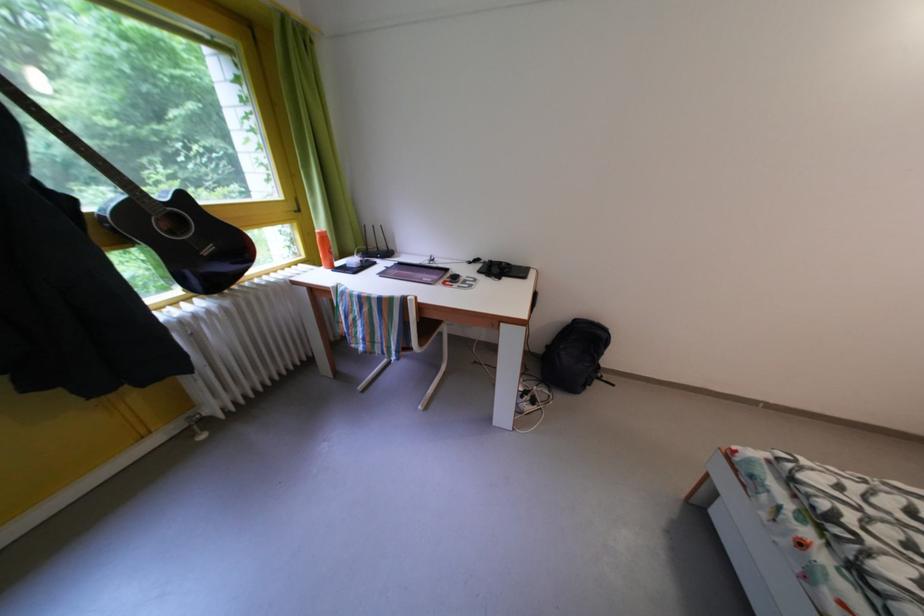
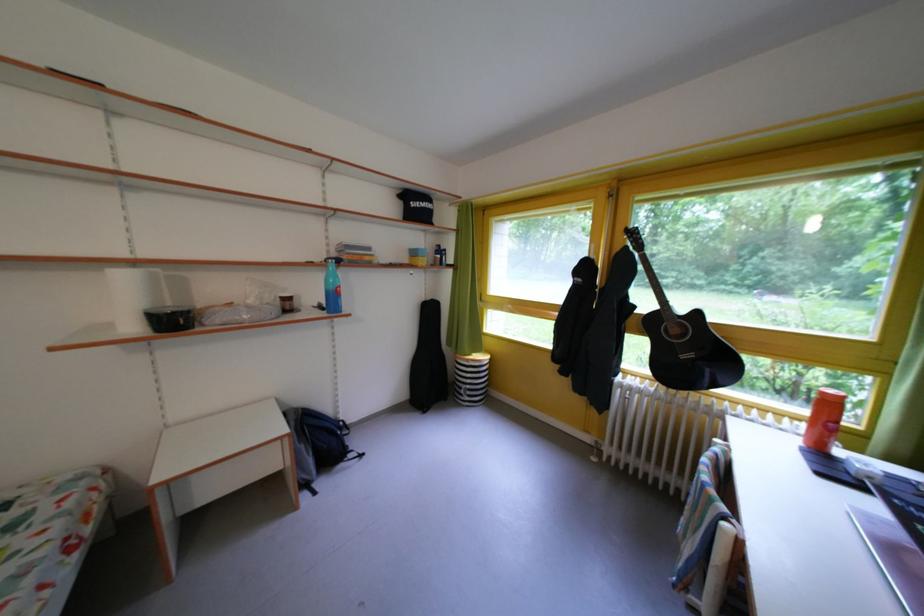
Where in the second image is the point corresponding to (329,238) from the first image?

(833, 399)